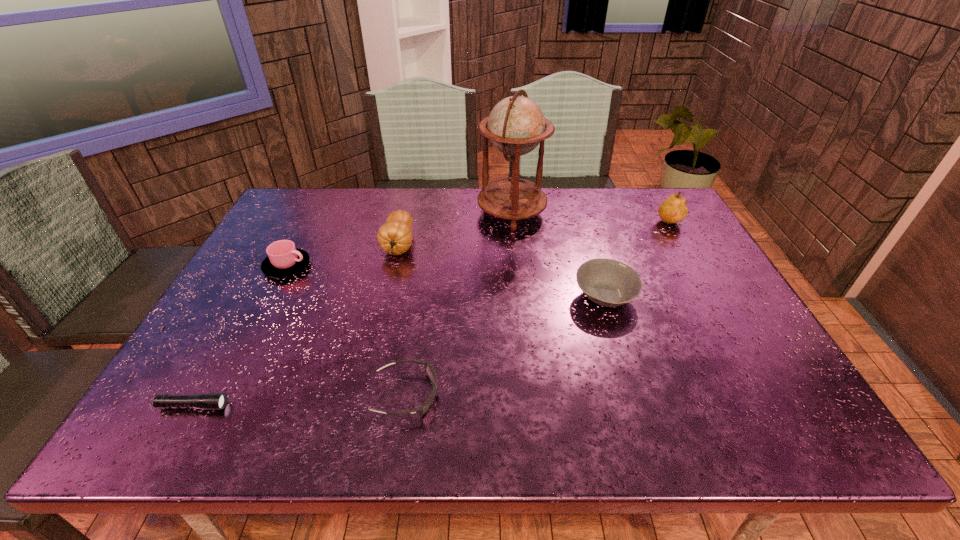
You are a GUI agent. You are given a task and a screenshot of the screen. Output one action in this format:
    pyautogui.click(x=<x>, y=<y>)
    Task: Click on the empty space between the gourd and the flashlight
    
    Given the screenshot: What is the action you would take?
    pyautogui.click(x=297, y=326)

I want to click on vacant space that's between the cup and the bowl, so (446, 281).

This screenshot has height=540, width=960. Find the location of `the fourth closest object to the pear`. the fourth closest object to the pear is located at coordinates (429, 369).

You are a GUI agent. You are given a task and a screenshot of the screen. Output one action in this format:
    pyautogui.click(x=<x>, y=<y>)
    Task: Click on the object that is the fourth closest one to the bowl
    The image size is (960, 540).
    Given the screenshot: What is the action you would take?
    pyautogui.click(x=395, y=237)

The image size is (960, 540). In order to click on free space that satisfies the following two spatial constraints: 1. on the surface of the fifth object from left to right; 2. on the right side of the pear in this screenshot , I will do `click(513, 225)`.

Find the location of a particular element. The image size is (960, 540). blank area in the image that satisfies the following two spatial constraints: 1. on the surface of the third object from right to left; 2. on the back side of the bowl is located at coordinates (520, 296).

Identify the location of vacant space that satisfies the following two spatial constraints: 1. on the surface of the tallest object; 2. on the back side of the pear. This screenshot has height=540, width=960. (513, 225).

This screenshot has width=960, height=540. What are the coordinates of `vacant area that satisfies the following two spatial constraints: 1. on the stem side of the gourd; 2. on the left side of the sixth object from left to right` in the screenshot? It's located at (387, 296).

Locate an element on the screen. vacant space that satisfies the following two spatial constraints: 1. on the stem side of the gourd; 2. on the side with the handle of the cup is located at coordinates (394, 266).